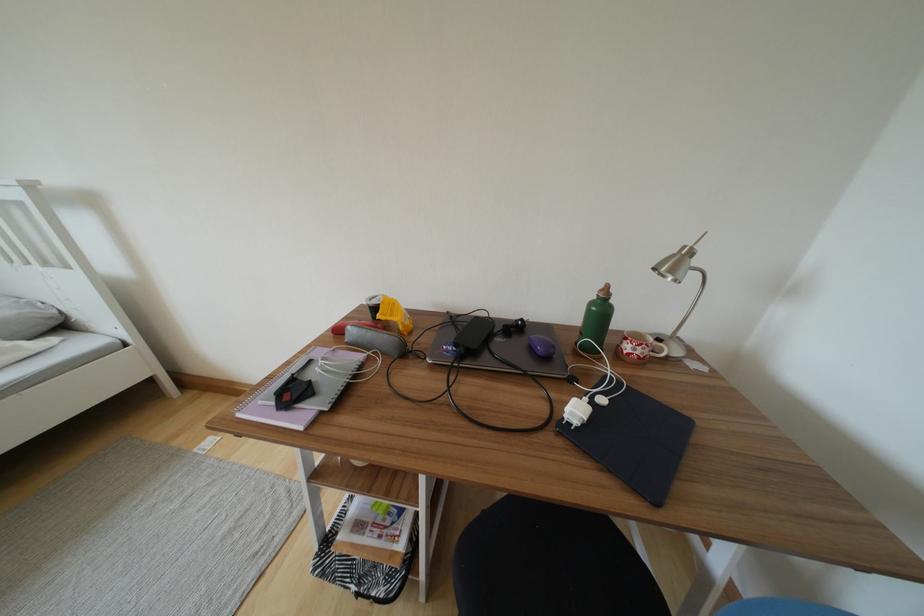
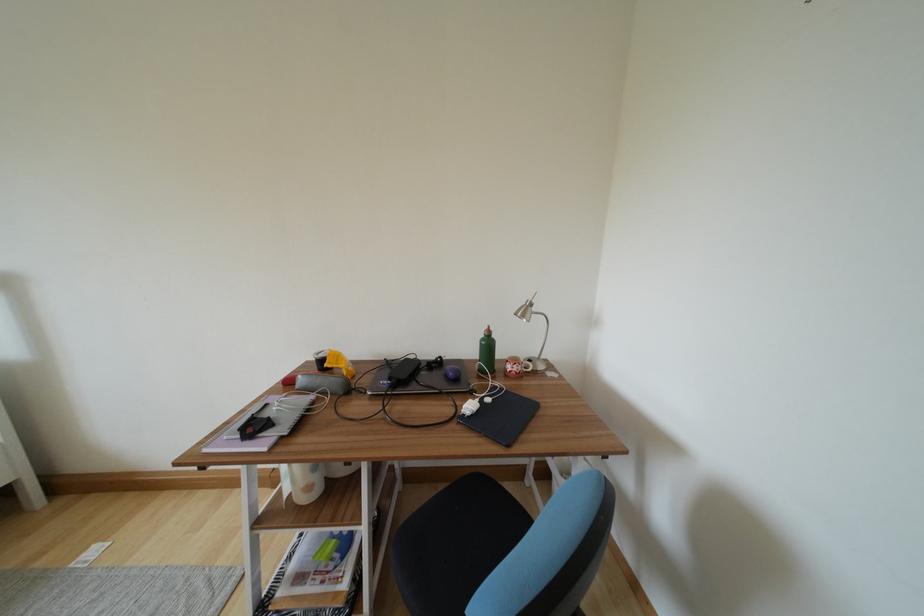
Find the pixel in the second image that matches [460,349] in the first image.

(395, 382)